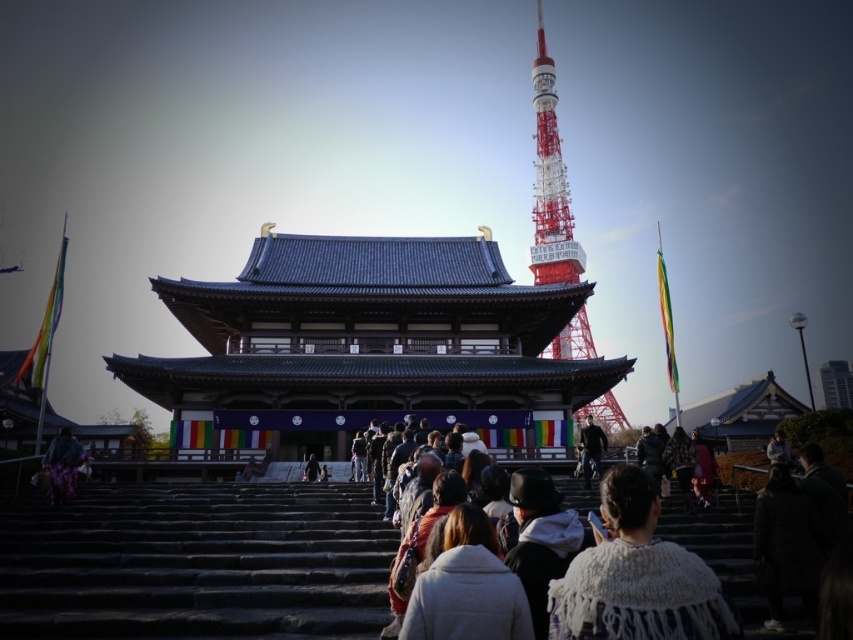
You are standing at the base of the temple stairs and want to take a photo of the shiny blue pagoda at center. If your camera has a maximum zoom range of 50 meters, will you be able to capture a clear image of the pagoda?

The shiny blue pagoda at center is 49.66 meters away from the viewer. Since the camera can zoom up to 50 meters, you can capture a clear image of the pagoda as the distance is within the camera range.

You are standing at the base of the temple stairs and want to take a photo of the Tokyo Tower. There is a point marked at coordinates point (155, 291) that you need to consider. Can you determine if the Tokyo Tower is visible from your current position without any obstructions?

The distance between you and point (155, 291) is 174.34 feet. Since the Tokyo Tower is in the background of the temple scene, it should be visible from your current position at the base of the temple stairs as there are no mentioned obstructions in the scene description.